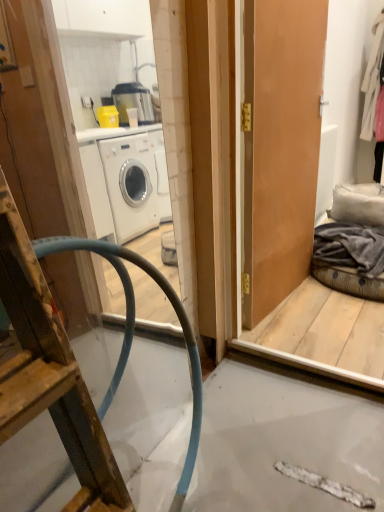
Question: From a real-world perspective, does blue rubber hose at left sit lower than white textured radiator at right?

Choices:
 (A) no
 (B) yes

Answer: (B)

Question: Are blue rubber hose at left and white textured radiator at right beside each other?

Choices:
 (A) no
 (B) yes

Answer: (A)

Question: Is blue rubber hose at left facing away from white textured radiator at right?

Choices:
 (A) no
 (B) yes

Answer: (A)

Question: Considering the relative sizes of blue rubber hose at left and white textured radiator at right in the image provided, is blue rubber hose at left thinner than white textured radiator at right?

Choices:
 (A) yes
 (B) no

Answer: (B)

Question: Is blue rubber hose at left not inside white textured radiator at right?

Choices:
 (A) no
 (B) yes

Answer: (B)

Question: Is point (278, 216) closer or farther from the camera than point (322, 257)?

Choices:
 (A) closer
 (B) farther

Answer: (A)

Question: From a real-world perspective, is matte brown door at center physically located above or below gray cotton blanket at right, which appears as the first clothing when viewed from the left?

Choices:
 (A) below
 (B) above

Answer: (B)

Question: Relative to gray cotton blanket at right, which appears as the first clothing when viewed from the left, is matte brown door at center in front or behind?

Choices:
 (A) front
 (B) behind

Answer: (A)

Question: Considering the positions of matte brown door at center and gray cotton blanket at right, which is the 1th clothing from front to back, in the image, is matte brown door at center wider or thinner than gray cotton blanket at right, which is the 1th clothing from front to back,?

Choices:
 (A) wide
 (B) thin

Answer: (B)

Question: Is point (119, 269) closer or farther from the camera than point (312, 256)?

Choices:
 (A) closer
 (B) farther

Answer: (A)

Question: Relative to gray cotton blanket at right, the 2th clothing in the right-to-left sequence, is blue rubber hose at left in front or behind?

Choices:
 (A) front
 (B) behind

Answer: (A)

Question: In terms of height, does blue rubber hose at left look taller or shorter compared to gray cotton blanket at right, which is counted as the 1th clothing, starting from the bottom?

Choices:
 (A) tall
 (B) short

Answer: (A)

Question: Would you say blue rubber hose at left is to the left or to the right of gray cotton blanket at right, which is counted as the second clothing, starting from the top, in the picture?

Choices:
 (A) right
 (B) left

Answer: (B)

Question: Do you think white wool coat at upper right, which is the second clothing in bottom-to-top order, is within matte brown door at center, or outside of it?

Choices:
 (A) outside
 (B) inside

Answer: (A)

Question: Is point (372, 50) positioned closer to the camera than point (251, 160)?

Choices:
 (A) farther
 (B) closer

Answer: (A)